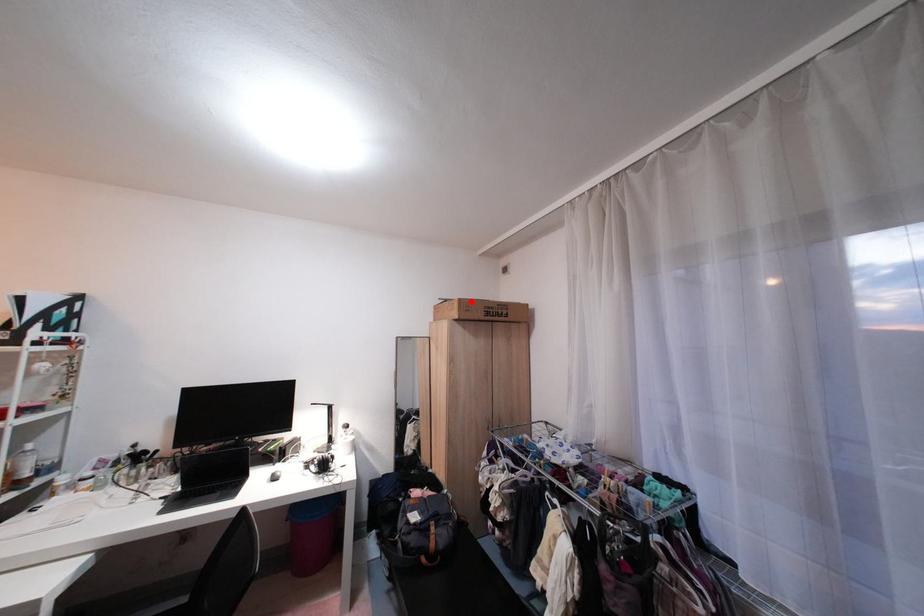
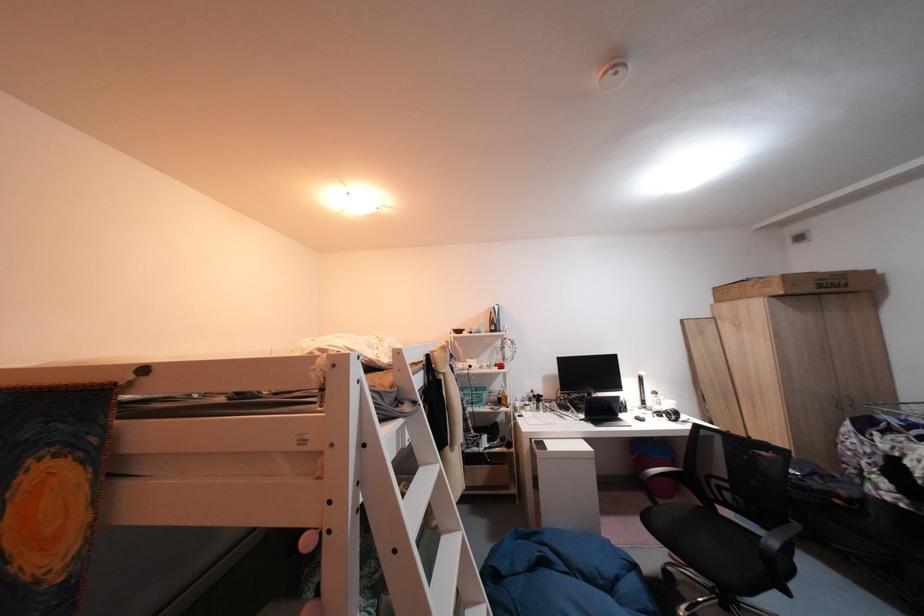
In the second image, find the point that corresponds to the highlighted location in the first image.

(794, 278)